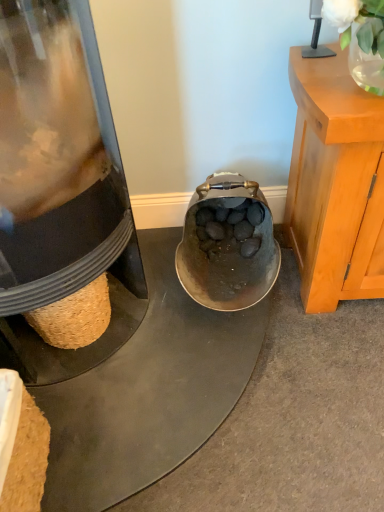
Question: Is translucent glass vase at upper right not close to matte black kettle at lower left?

Choices:
 (A) no
 (B) yes

Answer: (A)

Question: Is translucent glass vase at upper right smaller than matte black kettle at lower left?

Choices:
 (A) yes
 (B) no

Answer: (A)

Question: From the image's perspective, is translucent glass vase at upper right above matte black kettle at lower left?

Choices:
 (A) yes
 (B) no

Answer: (A)

Question: From the image's perspective, is translucent glass vase at upper right under matte black kettle at lower left?

Choices:
 (A) no
 (B) yes

Answer: (A)

Question: Is translucent glass vase at upper right at the right side of matte black kettle at lower left?

Choices:
 (A) yes
 (B) no

Answer: (A)

Question: Does translucent glass vase at upper right have a lesser height compared to matte black kettle at lower left?

Choices:
 (A) no
 (B) yes

Answer: (B)

Question: Does matte black kettle at lower left have a larger size compared to translucent glass vase at upper right?

Choices:
 (A) yes
 (B) no

Answer: (A)

Question: Is matte black kettle at lower left to the left of translucent glass vase at upper right from the viewer's perspective?

Choices:
 (A) yes
 (B) no

Answer: (A)

Question: Is matte black kettle at lower left thinner than translucent glass vase at upper right?

Choices:
 (A) yes
 (B) no

Answer: (B)

Question: Is there a large distance between matte black kettle at lower left and translucent glass vase at upper right?

Choices:
 (A) yes
 (B) no

Answer: (B)

Question: Would you say matte black kettle at lower left contains translucent glass vase at upper right?

Choices:
 (A) yes
 (B) no

Answer: (B)

Question: Is matte black kettle at lower left outside translucent glass vase at upper right?

Choices:
 (A) no
 (B) yes

Answer: (B)

Question: Is point (364, 17) closer or farther from the camera than point (9, 336)?

Choices:
 (A) closer
 (B) farther

Answer: (A)